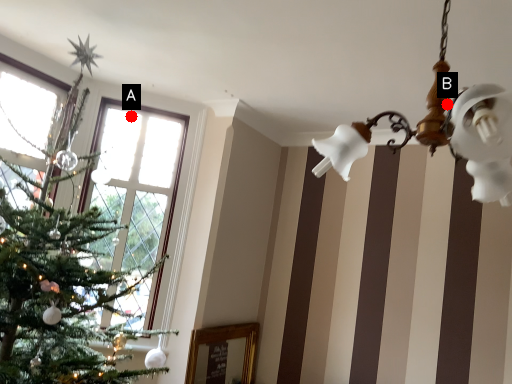
Question: Two points are circled on the image, labeled by A and B beside each circle. Which point appears farthest from the camera in this image?

Choices:
 (A) A is further
 (B) B is further

Answer: (A)